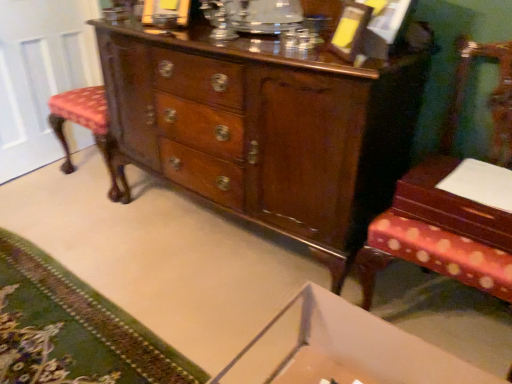
Question: Relative to mahogany wood table at right, is green carpet at lower left in front or behind?

Choices:
 (A) front
 (B) behind

Answer: (A)

Question: Is point (73, 281) positioned closer to the camera than point (501, 223)?

Choices:
 (A) farther
 (B) closer

Answer: (A)

Question: Estimate the real-world distances between objects in this image. Which object is closer to the green carpet at lower left?

Choices:
 (A) white glossy door at left
 (B) wooden chair with patterned cushion at right
 (C) shiny brown wood chest of drawers at center
 (D) mahogany wood table at right
 (E) white cardboard changing table at lower center

Answer: (E)

Question: Estimate the real-world distances between objects in this image. Which object is closer to the white cardboard changing table at lower center?

Choices:
 (A) white glossy door at left
 (B) shiny brown wood chest of drawers at center
 (C) wooden chair with patterned cushion at right
 (D) green carpet at lower left
 (E) mahogany wood table at right

Answer: (C)